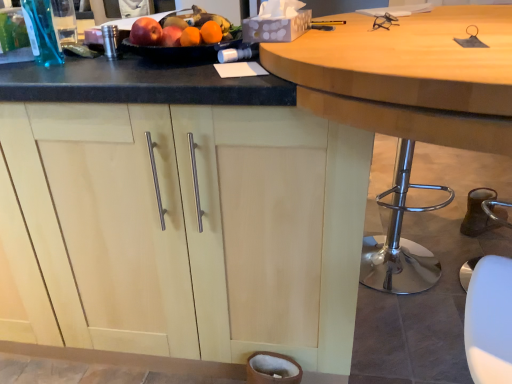
Question: Is wooden table at center positioned far away from light wood cabinet at center?

Choices:
 (A) no
 (B) yes

Answer: (A)

Question: Does wooden table at center turn towards light wood cabinet at center?

Choices:
 (A) no
 (B) yes

Answer: (A)

Question: Are wooden table at center and light wood cabinet at center making contact?

Choices:
 (A) yes
 (B) no

Answer: (B)

Question: Can you confirm if wooden table at center is shorter than light wood cabinet at center?

Choices:
 (A) yes
 (B) no

Answer: (B)

Question: Is wooden table at center oriented away from light wood cabinet at center?

Choices:
 (A) yes
 (B) no

Answer: (A)

Question: Is wooden table at center not within light wood cabinet at center?

Choices:
 (A) yes
 (B) no

Answer: (A)

Question: Is glossy plastic fruit dish at upper center oriented towards light wood cabinet at center?

Choices:
 (A) no
 (B) yes

Answer: (A)

Question: Would you say glossy plastic fruit dish at upper center is a long distance from light wood cabinet at center?

Choices:
 (A) yes
 (B) no

Answer: (B)

Question: Is glossy plastic fruit dish at upper center with light wood cabinet at center?

Choices:
 (A) yes
 (B) no

Answer: (B)

Question: From a real-world perspective, is glossy plastic fruit dish at upper center physically above light wood cabinet at center?

Choices:
 (A) no
 (B) yes

Answer: (B)

Question: Does glossy plastic fruit dish at upper center have a larger size compared to light wood cabinet at center?

Choices:
 (A) no
 (B) yes

Answer: (A)

Question: Can you confirm if glossy plastic fruit dish at upper center is shorter than light wood cabinet at center?

Choices:
 (A) yes
 (B) no

Answer: (A)

Question: Does glossy plastic fruit dish at upper center come behind wooden table at center?

Choices:
 (A) yes
 (B) no

Answer: (A)